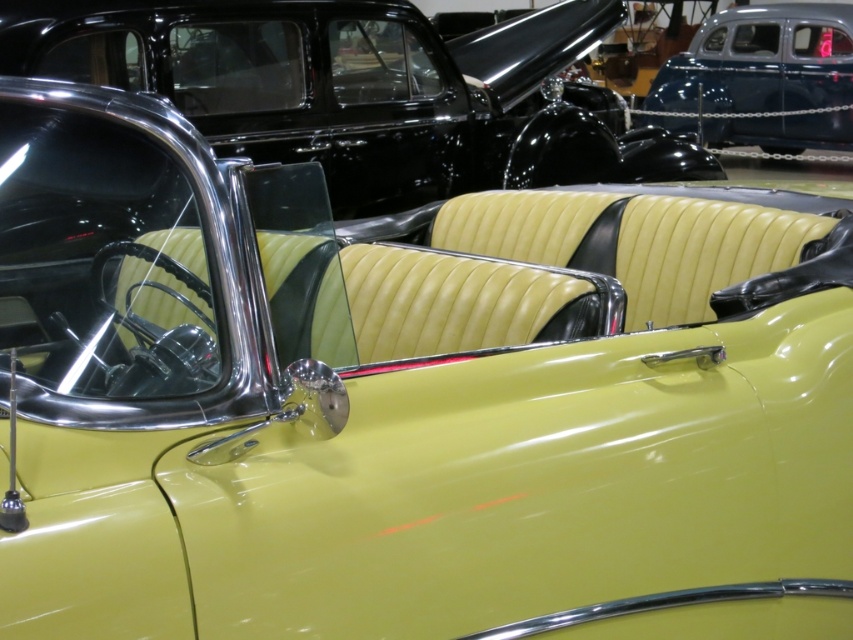
You are a parking attendant and need to fit both the matte yellow leather car at center and the matte blue car at upper right into a parking spot that is 2 meters wide. Based on their sizes, will both cars fit side by side in the spot?

The matte yellow leather car at center is wider than the matte blue car at upper right. Since the parking spot is only 2 meters wide, and the combined width of both cars exceeds this limit, they cannot fit side by side in the parking spot.

You are a photographer standing at the scene. You want to take a photo of the matte yellow leather car at center and the matte blue car at upper right. If your camera can focus on objects within 6 meters, will both cars be in focus?

The matte yellow leather car at center is 5.94 meters away from the matte blue car at upper right. Since the distance between them is less than 6 meters, both cars will be within the camera focus range and appear sharp in the photo.